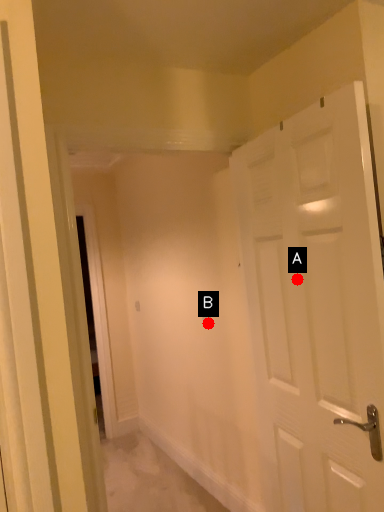
Question: Two points are circled on the image, labeled by A and B beside each circle. Which point is closer to the camera taking this photo?

Choices:
 (A) A is closer
 (B) B is closer

Answer: (A)